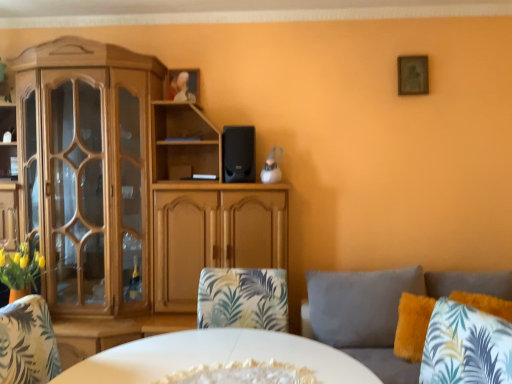
Question: Is wooden cabinet at left wider than black matte speaker at center?

Choices:
 (A) no
 (B) yes

Answer: (B)

Question: Can you confirm if wooden cabinet at left is thinner than black matte speaker at center?

Choices:
 (A) yes
 (B) no

Answer: (B)

Question: Can you confirm if wooden cabinet at left is taller than black matte speaker at center?

Choices:
 (A) no
 (B) yes

Answer: (B)

Question: Is wooden cabinet at left positioned before black matte speaker at center?

Choices:
 (A) no
 (B) yes

Answer: (B)

Question: From the image's perspective, does wooden cabinet at left appear higher than black matte speaker at center?

Choices:
 (A) yes
 (B) no

Answer: (B)

Question: Visually, is fluffy gray couch at right positioned to the left or to the right of white glossy plate at center?

Choices:
 (A) right
 (B) left

Answer: (A)

Question: Considering their positions, is fluffy gray couch at right located in front of or behind white glossy plate at center?

Choices:
 (A) front
 (B) behind

Answer: (A)

Question: Is fluffy gray couch at right bigger or smaller than white glossy plate at center?

Choices:
 (A) big
 (B) small

Answer: (A)

Question: Does point (379, 349) appear closer or farther from the camera than point (139, 357)?

Choices:
 (A) closer
 (B) farther

Answer: (B)

Question: Considering the positions of wooden picture frame at upper right and fluffy gray couch at right in the image, is wooden picture frame at upper right wider or thinner than fluffy gray couch at right?

Choices:
 (A) thin
 (B) wide

Answer: (A)

Question: Visually, is wooden picture frame at upper right positioned to the left or to the right of fluffy gray couch at right?

Choices:
 (A) right
 (B) left

Answer: (A)

Question: From a real-world perspective, is wooden picture frame at upper right above or below fluffy gray couch at right?

Choices:
 (A) above
 (B) below

Answer: (A)

Question: In terms of size, does wooden picture frame at upper right appear bigger or smaller than fluffy gray couch at right?

Choices:
 (A) small
 (B) big

Answer: (A)

Question: From the image's perspective, is fluffy yellow pillow at lower right located above or below wooden cabinet at left?

Choices:
 (A) above
 (B) below

Answer: (B)

Question: Do you think fluffy yellow pillow at lower right is within wooden cabinet at left, or outside of it?

Choices:
 (A) outside
 (B) inside

Answer: (A)